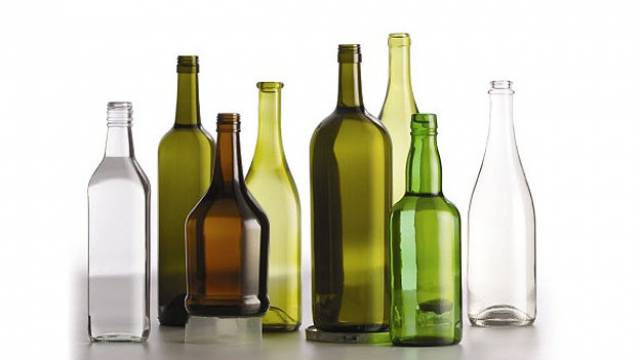
Locate an element on the screen. glass bottles is located at coordinates (108, 209), (185, 168), (227, 209), (278, 202), (352, 226), (422, 258), (393, 104), (497, 210).